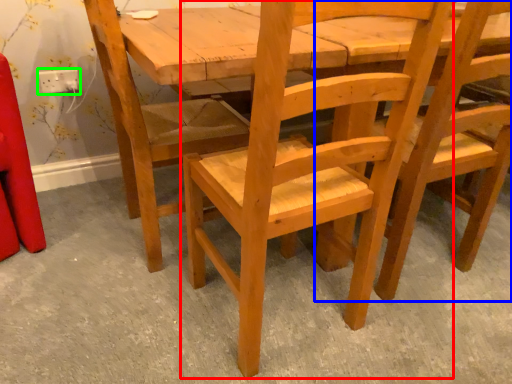
Question: Based on their relative distances, which object is farther from chair (highlighted by a red box)? Choose from chair (highlighted by a blue box) and electric outlet (highlighted by a green box).

Choices:
 (A) chair
 (B) electric outlet

Answer: (B)